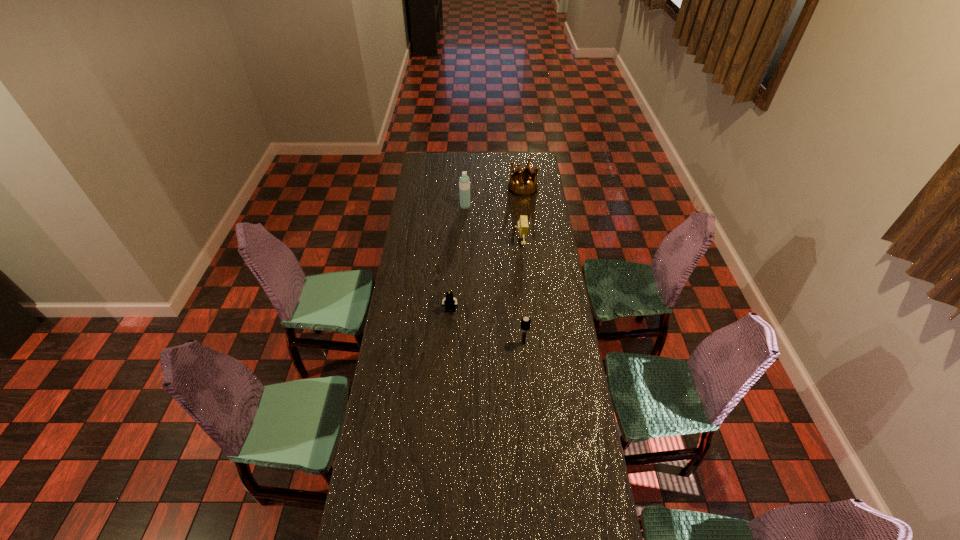
You are a GUI agent. You are given a task and a screenshot of the screen. Output one action in this format:
    pyautogui.click(x=<x>, y=<y>)
    Task: Click on the vacant region that satisfies the following two spatial constraints: 1. on the face of the third farthest object; 2. on the front-facing side of the shortest object
    The height and width of the screenshot is (540, 960).
    Given the screenshot: What is the action you would take?
    pyautogui.click(x=526, y=311)